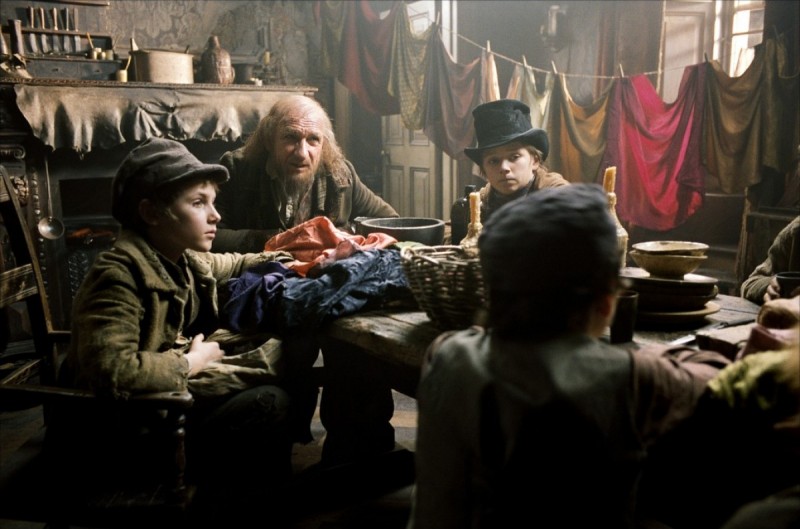
This screenshot has height=529, width=800. Identify the location of window. (742, 30).